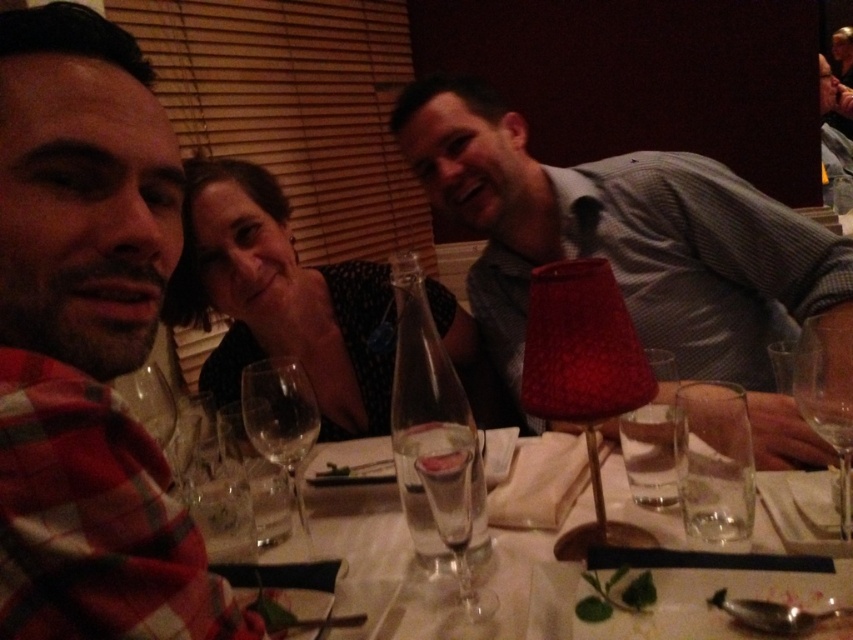
You are a photographer standing in front of the dining table. You want to take a clear photo of the matte plaid shirt at left without moving the subject. Can you adjust your position to ensure the subject is in focus? Please explain your reasoning.

The matte plaid shirt at left and viewer are 14.08 inches apart. Since the subject is slightly out of focus in the current image, adjusting your position closer or farther away by a few inches might help achieve focus. However, the exact adjustment needed depends on the camera lens and its focusing mechanism.

You are a photographer trying to capture a clear shot of the transparent glass wine glass at right and the matte black shirt at center. Which object should you focus on first to ensure it appears sharp in the final image?

The matte black shirt at center is further to the viewer than the transparent glass wine glass at right. To ensure both appear sharp, focus on the matte black shirt at center first since it is closer to the camera.

From the picture: You are a waiter in a restaurant and need to place a 12 inch long decorative plate between the matte plaid shirt at left and the transparent glass wine glass at right. Will there be enough space for the plate?

The distance between the matte plaid shirt at left and the transparent glass wine glass at right is 24.52 inches. Since the plate is 12 inches long, there is sufficient space to place it between them.